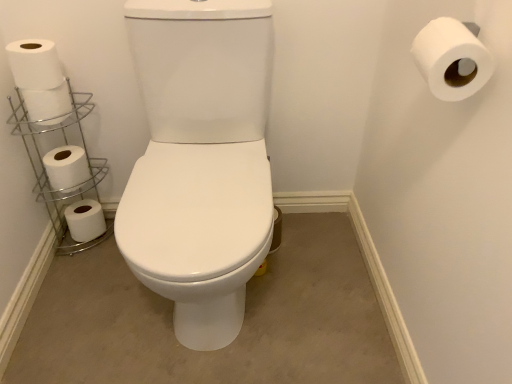
Find the location of a particular element. The image size is (512, 384). vacant area that is in front of silver/metallic toilet paper holder at left is located at coordinates (82, 274).